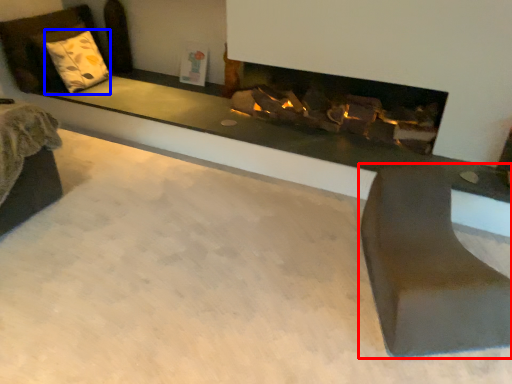
Question: Which object is further to the camera taking this photo, furniture (highlighted by a red box) or pillow (highlighted by a blue box)?

Choices:
 (A) furniture
 (B) pillow

Answer: (B)